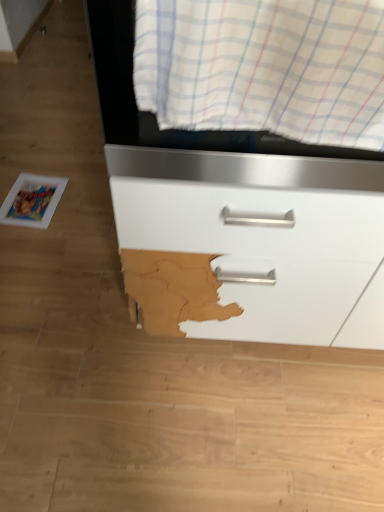
Question: Does matte white drawer at center lie in front of white striped fabric at upper center?

Choices:
 (A) yes
 (B) no

Answer: (B)

Question: Is white striped fabric at upper center a part of matte white drawer at center?

Choices:
 (A) no
 (B) yes

Answer: (A)

Question: Is there a large distance between matte white drawer at center and white striped fabric at upper center?

Choices:
 (A) no
 (B) yes

Answer: (A)

Question: From the image's perspective, is matte white drawer at center located above white striped fabric at upper center?

Choices:
 (A) yes
 (B) no

Answer: (B)

Question: Does matte white drawer at center have a lesser width compared to white striped fabric at upper center?

Choices:
 (A) yes
 (B) no

Answer: (B)

Question: Relative to matte white drawer at center, is white glossy magazine at lower left in front or behind?

Choices:
 (A) front
 (B) behind

Answer: (B)

Question: From the image's perspective, is white glossy magazine at lower left positioned above or below matte white drawer at center?

Choices:
 (A) above
 (B) below

Answer: (A)

Question: In terms of height, does white glossy magazine at lower left look taller or shorter compared to matte white drawer at center?

Choices:
 (A) short
 (B) tall

Answer: (A)

Question: Looking at their shapes, would you say white glossy magazine at lower left is wider or thinner than matte white drawer at center?

Choices:
 (A) wide
 (B) thin

Answer: (B)

Question: Considering the positions of white striped fabric at upper center and white glossy magazine at lower left in the image, is white striped fabric at upper center wider or thinner than white glossy magazine at lower left?

Choices:
 (A) thin
 (B) wide

Answer: (A)

Question: Considering the positions of white striped fabric at upper center and white glossy magazine at lower left in the image, is white striped fabric at upper center taller or shorter than white glossy magazine at lower left?

Choices:
 (A) short
 (B) tall

Answer: (B)

Question: Considering the positions of point (379, 117) and point (29, 209), is point (379, 117) closer or farther from the camera than point (29, 209)?

Choices:
 (A) closer
 (B) farther

Answer: (A)

Question: In the image, is white striped fabric at upper center positioned in front of or behind white glossy magazine at lower left?

Choices:
 (A) front
 (B) behind

Answer: (A)

Question: From the image's perspective, is matte white drawer at center positioned above or below white striped fabric at upper center?

Choices:
 (A) above
 (B) below

Answer: (B)

Question: Would you say matte white drawer at center is to the left or to the right of white striped fabric at upper center in the picture?

Choices:
 (A) right
 (B) left

Answer: (A)